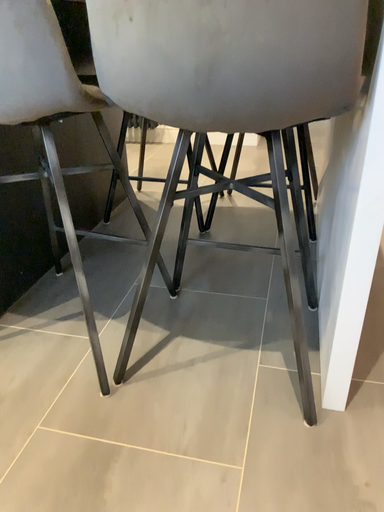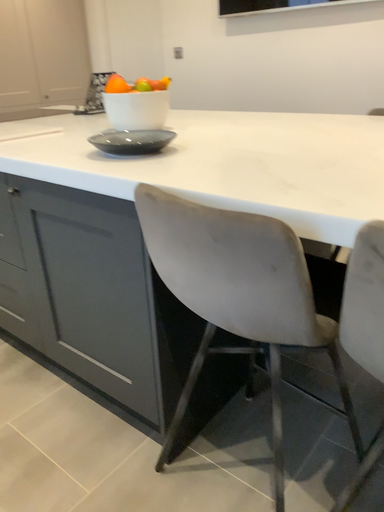
Question: How did the camera likely rotate when shooting the video?

Choices:
 (A) rotated left
 (B) rotated right

Answer: (A)